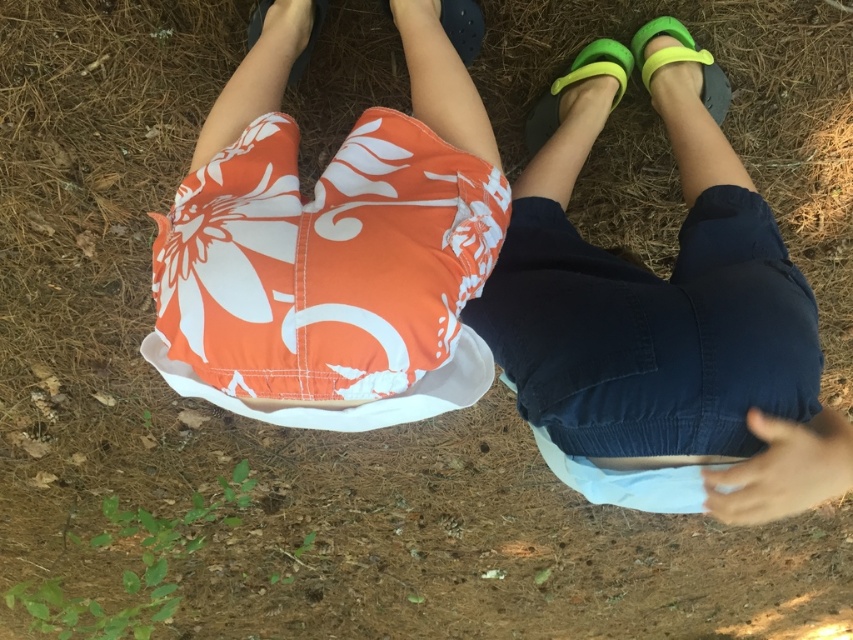
The image size is (853, 640). In order to click on orange floral shorts at center in this screenshot , I will do `click(329, 230)`.

Is point (196, 189) behind point (582, 70)?

No, (196, 189) is in front of (582, 70).

Image resolution: width=853 pixels, height=640 pixels. I want to click on orange floral shorts at center, so click(329, 230).

Is rubber textured sandal at upper center bigger than matte black sandal at upper center?

Actually, rubber textured sandal at upper center might be smaller than matte black sandal at upper center.

Is rubber textured sandal at upper center further to camera compared to matte black sandal at upper center?

No.

Where is `rubber textured sandal at upper center`? This screenshot has width=853, height=640. rubber textured sandal at upper center is located at coordinates (462, 26).

Can you confirm if neon green rubber sandal at lower right is shorter than matte black sandal at upper center?

In fact, neon green rubber sandal at lower right may be taller than matte black sandal at upper center.

What do you see at coordinates (682, 60) in the screenshot?
I see `neon green rubber sandal at lower right` at bounding box center [682, 60].

Locate an element on the screen. neon green rubber sandal at lower right is located at coordinates [x=682, y=60].